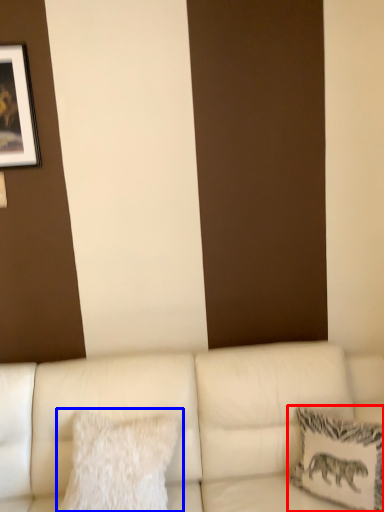
Question: Which object appears farthest to the camera in this image, pillow (highlighted by a red box) or pillow (highlighted by a blue box)?

Choices:
 (A) pillow
 (B) pillow

Answer: (B)